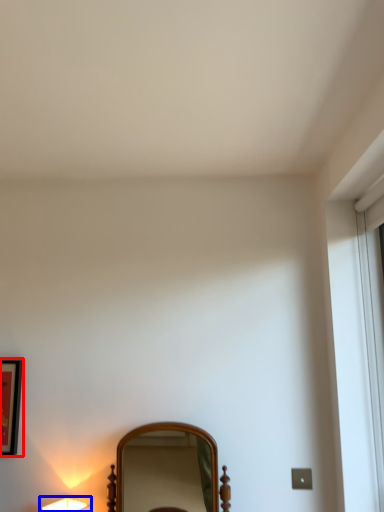
Question: Which object is closer to the camera taking this photo, picture frame (highlighted by a red box) or lamp (highlighted by a blue box)?

Choices:
 (A) picture frame
 (B) lamp

Answer: (B)